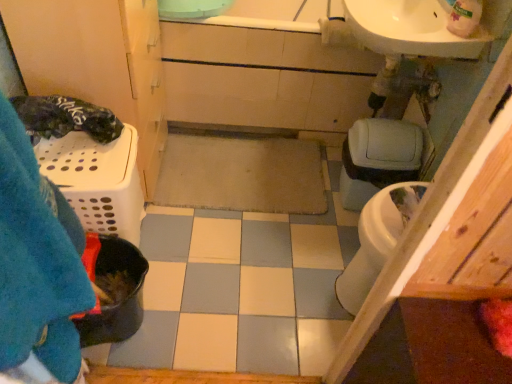
Question: Does matte gray toilet bowl at right turn towards white plastic laundry basket at left?

Choices:
 (A) yes
 (B) no

Answer: (B)

Question: Is matte gray toilet bowl at right not close to white plastic laundry basket at left?

Choices:
 (A) yes
 (B) no

Answer: (B)

Question: Is matte gray toilet bowl at right placed right next to white plastic laundry basket at left?

Choices:
 (A) yes
 (B) no

Answer: (B)

Question: Can you confirm if matte gray toilet bowl at right is thinner than white plastic laundry basket at left?

Choices:
 (A) yes
 (B) no

Answer: (A)

Question: Does matte gray toilet bowl at right have a smaller size compared to white plastic laundry basket at left?

Choices:
 (A) yes
 (B) no

Answer: (A)

Question: Can you confirm if matte gray toilet bowl at right is positioned to the right of white plastic laundry basket at left?

Choices:
 (A) yes
 (B) no

Answer: (A)

Question: Is matte gray toilet bowl at right positioned with its back to blue fuzzy blanket at left?

Choices:
 (A) yes
 (B) no

Answer: (B)

Question: Can you confirm if matte gray toilet bowl at right is taller than blue fuzzy blanket at left?

Choices:
 (A) yes
 (B) no

Answer: (B)

Question: From a real-world perspective, does matte gray toilet bowl at right sit lower than blue fuzzy blanket at left?

Choices:
 (A) no
 (B) yes

Answer: (B)

Question: Is matte gray toilet bowl at right positioned far away from blue fuzzy blanket at left?

Choices:
 (A) yes
 (B) no

Answer: (A)

Question: Can you confirm if matte gray toilet bowl at right is thinner than blue fuzzy blanket at left?

Choices:
 (A) yes
 (B) no

Answer: (B)

Question: Can we say matte gray toilet bowl at right lies outside blue fuzzy blanket at left?

Choices:
 (A) yes
 (B) no

Answer: (A)

Question: Is white glossy sink at upper right aimed at blue fuzzy blanket at left?

Choices:
 (A) no
 (B) yes

Answer: (A)